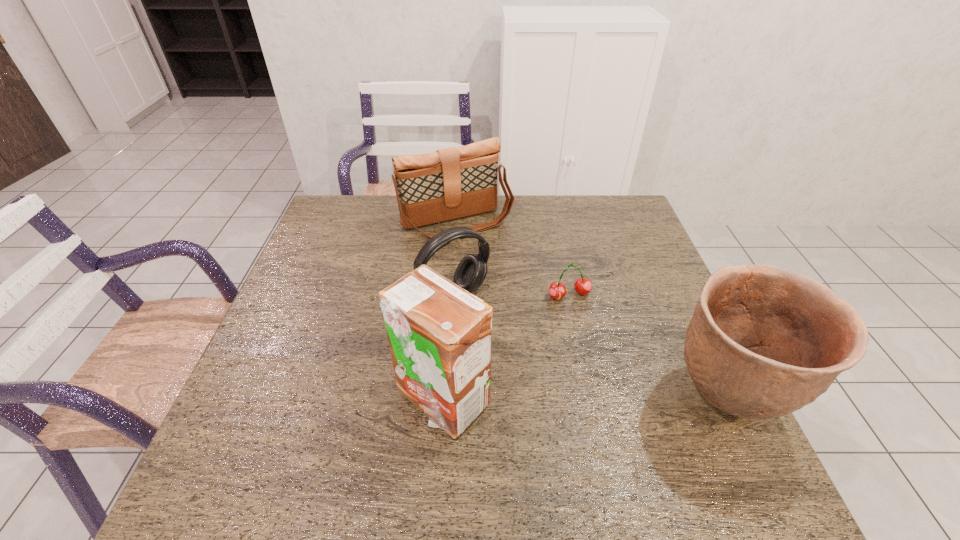
I want to click on free location that satisfies the following two spatial constraints: 1. on the front side of the headset; 2. on the right side of the farthest object, so click(452, 294).

The image size is (960, 540). What are the coordinates of `vacant space that satisfies the following two spatial constraints: 1. on the front side of the shoulder bag; 2. on the right side of the headset` in the screenshot? It's located at (452, 294).